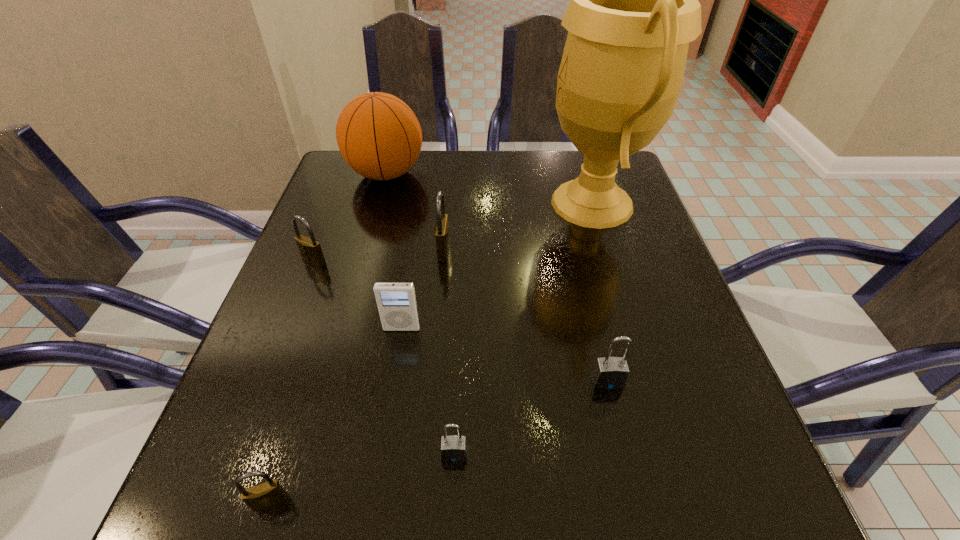
In order to click on free location located 0.240m on the right of the leftmost brass padlock in this screenshot , I will do `click(439, 261)`.

You are a GUI agent. You are given a task and a screenshot of the screen. Output one action in this format:
    pyautogui.click(x=<x>, y=<y>)
    Task: Click on the vacant space located on the front-facing side of the iPod
    
    Given the screenshot: What is the action you would take?
    pyautogui.click(x=388, y=418)

The width and height of the screenshot is (960, 540). I want to click on blank space located 0.120m on the back of the nearest padlock, so click(x=298, y=412).

This screenshot has height=540, width=960. I want to click on trophy at the far edge, so click(x=634, y=8).

At what (x,y) coordinates should I click in order to perform the action: click on basketball present at the far edge. Please return your answer as a coordinate pair (x, y). This screenshot has width=960, height=540. Looking at the image, I should click on (378, 135).

This screenshot has height=540, width=960. Find the location of `object positioned at the near edge`. object positioned at the near edge is located at coordinates (264, 495).

Where is `basketball that is at the left edge`? The height and width of the screenshot is (540, 960). basketball that is at the left edge is located at coordinates (378, 135).

This screenshot has width=960, height=540. Identify the location of trophy located at the right edge. (634, 8).

Image resolution: width=960 pixels, height=540 pixels. What are the coordinates of `padlock situated at the right edge` in the screenshot? It's located at tap(609, 373).

The width and height of the screenshot is (960, 540). Identify the location of object that is at the far left corner. (378, 135).